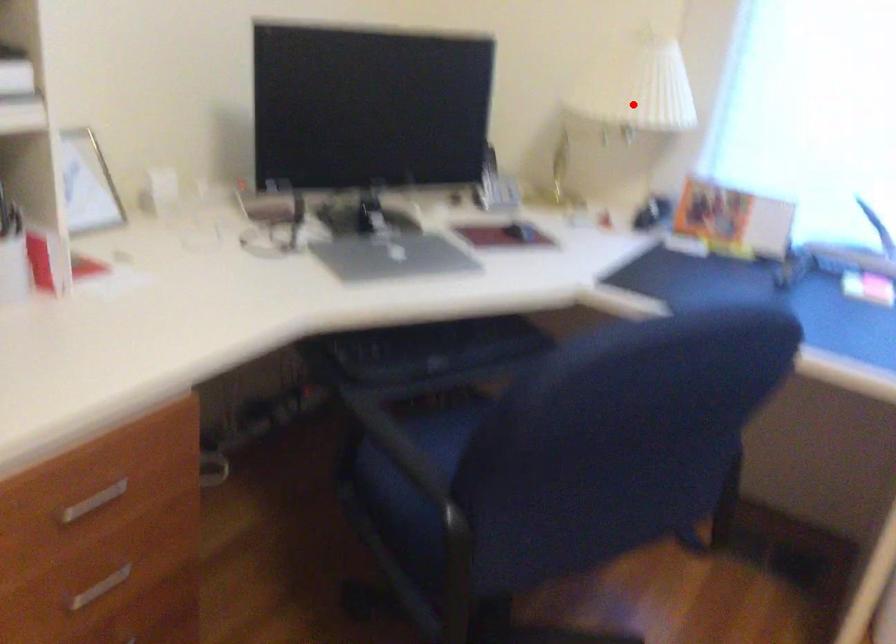
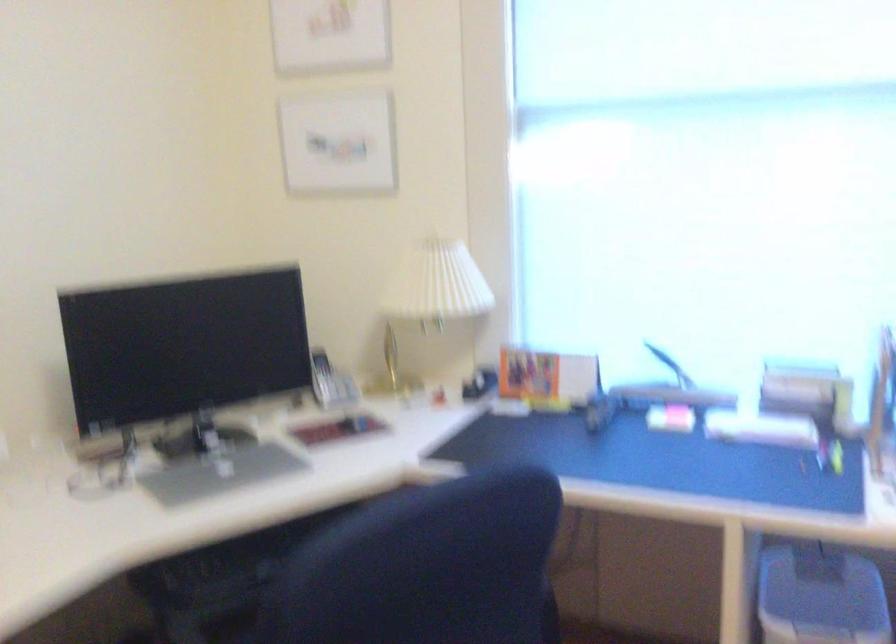
Find the pixel in the second image that matches the highlighted location in the first image.

(433, 295)